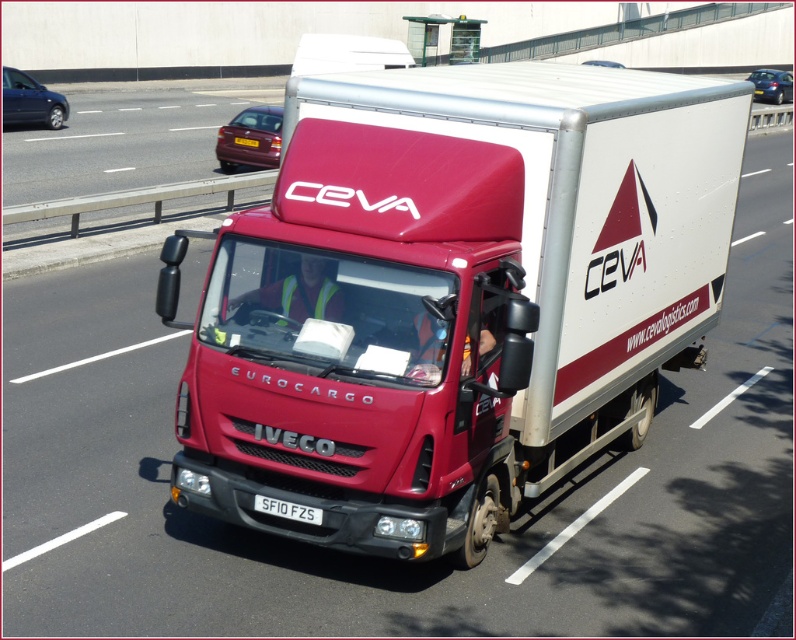
Question: Is matte red trailer truck at center to the left of shiny maroon car at upper left from the viewer's perspective?

Choices:
 (A) no
 (B) yes

Answer: (A)

Question: Is matte red trailer truck at center to the right of white plastic license plate at center from the viewer's perspective?

Choices:
 (A) yes
 (B) no

Answer: (A)

Question: Which point appears closest to the camera in this image?

Choices:
 (A) tap(274, 161)
 (B) tap(627, 410)
 (C) tap(162, 113)

Answer: (B)

Question: Can you confirm if matte red trailer truck at center is positioned to the left of shiny maroon car at upper left?

Choices:
 (A) no
 (B) yes

Answer: (A)

Question: Which point is closer to the camera?

Choices:
 (A) shiny maroon car at upper left
 (B) metallic gray barrier at left
 (C) matte red trailer truck at center
 (D) white plastic license plate at center

Answer: (C)

Question: Which point appears farthest from the camera in this image?

Choices:
 (A) (283, 502)
 (B) (72, 186)
 (C) (622, 332)

Answer: (B)